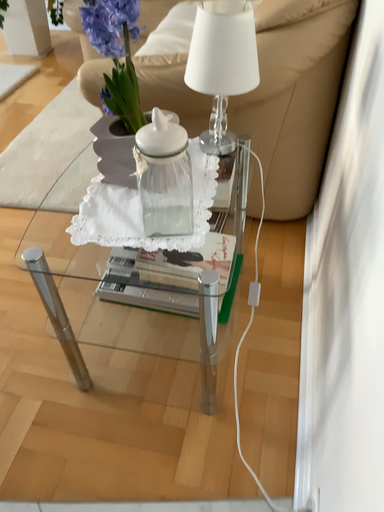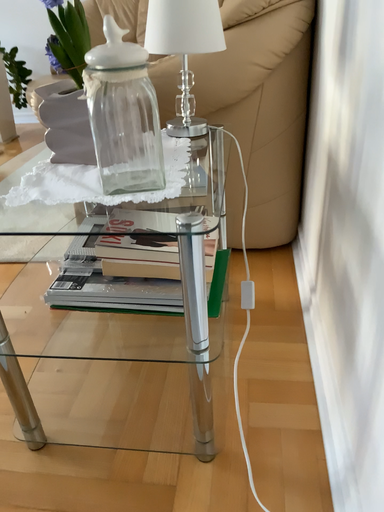
Question: How did the camera likely rotate when shooting the video?

Choices:
 (A) rotated upward
 (B) rotated downward

Answer: (A)